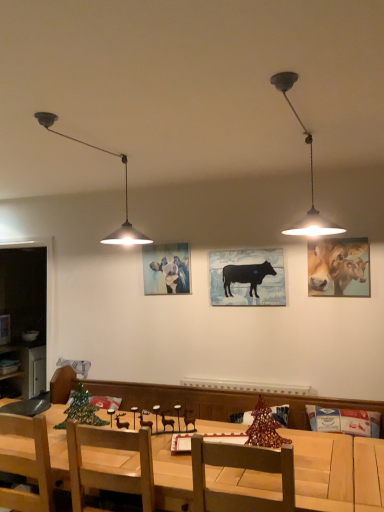
Where is `wooden table at center`? wooden table at center is located at coordinates (337, 471).

What are the coordinates of `golden glossy cattle at upper right, which is counted as the second cattle, starting from the back` in the screenshot? It's located at (335, 265).

Where is `metallic silver cabinet at left`? metallic silver cabinet at left is located at coordinates (32, 369).

Which point is more forward, (x=37, y=362) or (x=243, y=300)?

The point (x=243, y=300) is more forward.

Does metallic silver cabinet at left appear on the right side of black wooden cow at center?

No, metallic silver cabinet at left is not to the right of black wooden cow at center.

Is metallic silver cabinet at left bigger than black wooden cow at center?

Yes, metallic silver cabinet at left is bigger than black wooden cow at center.

Is golden glossy cattle at upper right, positioned as the first cattle in front-to-back order, positioned beyond the bounds of metallic pendant light at upper right, the second lamp positioned from the left?

Absolutely, golden glossy cattle at upper right, positioned as the first cattle in front-to-back order, is external to metallic pendant light at upper right, the second lamp positioned from the left.

Which is nearer, (334, 293) or (278, 84)?

Point (334, 293) is farther from the camera than point (278, 84).

Can you confirm if golden glossy cattle at upper right, the first cattle in the right-to-left sequence, is wider than metallic pendant light at upper right, the first lamp when ordered from right to left?

No.

Is golden glossy cattle at upper right, marked as the 2th cattle in a left-to-right arrangement, beside metallic pendant light at upper right, the second lamp positioned from the left?

golden glossy cattle at upper right, marked as the 2th cattle in a left-to-right arrangement, and metallic pendant light at upper right, the second lamp positioned from the left, are clearly separated.

In the scene shown: From a real-world perspective, relative to golden glossy cattle at upper right, marked as the 2th cattle in a left-to-right arrangement, is pastel blue painting of cattle at center, the 1th cattle from the back, vertically above or below?

Clearly, from a real-world perspective, pastel blue painting of cattle at center, the 1th cattle from the back, is above golden glossy cattle at upper right, marked as the 2th cattle in a left-to-right arrangement.

Considering the relative sizes of pastel blue painting of cattle at center, which is the 2th cattle from right to left, and golden glossy cattle at upper right, marked as the 2th cattle in a left-to-right arrangement, in the image provided, is pastel blue painting of cattle at center, which is the 2th cattle from right to left, wider than golden glossy cattle at upper right, marked as the 2th cattle in a left-to-right arrangement,?

Yes, pastel blue painting of cattle at center, which is the 2th cattle from right to left, is wider than golden glossy cattle at upper right, marked as the 2th cattle in a left-to-right arrangement.

Is pastel blue painting of cattle at center, the 1th cattle from the back, smaller than golden glossy cattle at upper right, positioned as the first cattle in front-to-back order?

Actually, pastel blue painting of cattle at center, the 1th cattle from the back, might be larger than golden glossy cattle at upper right, positioned as the first cattle in front-to-back order.

Which is less distant, (313,259) or (30,351)?

Positioned in front is point (313,259).

In the scene shown: From a real-world perspective, is golden glossy cattle at upper right, which is counted as the second cattle, starting from the back, physically located above or below metallic silver cabinet at left?

golden glossy cattle at upper right, which is counted as the second cattle, starting from the back, is situated higher than metallic silver cabinet at left in the real world.

Looking at this image, considering the relative sizes of golden glossy cattle at upper right, which is counted as the second cattle, starting from the back, and metallic silver cabinet at left in the image provided, is golden glossy cattle at upper right, which is counted as the second cattle, starting from the back, shorter than metallic silver cabinet at left?

Indeed, golden glossy cattle at upper right, which is counted as the second cattle, starting from the back, has a lesser height compared to metallic silver cabinet at left.

Who is smaller, golden glossy cattle at upper right, marked as the 2th cattle in a left-to-right arrangement, or metallic silver cabinet at left?

golden glossy cattle at upper right, marked as the 2th cattle in a left-to-right arrangement, is smaller.

Is metallic pendant light at left, marked as the 1th lamp in a left-to-right arrangement, placed right next to pastel blue painting of cattle at center, which ranks as the 1th cattle in left-to-right order?

No, metallic pendant light at left, marked as the 1th lamp in a left-to-right arrangement, is not next to pastel blue painting of cattle at center, which ranks as the 1th cattle in left-to-right order.

Which object is closer to the camera taking this photo, metallic pendant light at left, which ranks as the 2th lamp in right-to-left order, or pastel blue painting of cattle at center, the 1th cattle from the back?

Positioned in front is metallic pendant light at left, which ranks as the 2th lamp in right-to-left order.

Choose the correct answer: Is metallic pendant light at left, marked as the 1th lamp in a left-to-right arrangement, inside pastel blue painting of cattle at center, which ranks as the 1th cattle in left-to-right order, or outside it?

metallic pendant light at left, marked as the 1th lamp in a left-to-right arrangement, is spatially situated outside pastel blue painting of cattle at center, which ranks as the 1th cattle in left-to-right order.

Considering the sizes of objects metallic pendant light at left, marked as the 1th lamp in a left-to-right arrangement, and pastel blue painting of cattle at center, the 1th cattle from the back, in the image provided, who is smaller, metallic pendant light at left, marked as the 1th lamp in a left-to-right arrangement, or pastel blue painting of cattle at center, the 1th cattle from the back,?

pastel blue painting of cattle at center, the 1th cattle from the back.

Is the surface of golden glossy cattle at upper right, marked as the 2th cattle in a left-to-right arrangement, in direct contact with pastel blue painting of cattle at center, which ranks as the 1th cattle in left-to-right order?

No.

From a real-world perspective, is golden glossy cattle at upper right, positioned as the first cattle in front-to-back order, under pastel blue painting of cattle at center, the 1th cattle from the back?

Yes, from a real-world perspective, golden glossy cattle at upper right, positioned as the first cattle in front-to-back order, is beneath pastel blue painting of cattle at center, the 1th cattle from the back.

Looking at the image, does golden glossy cattle at upper right, which is counted as the second cattle, starting from the back, seem bigger or smaller compared to pastel blue painting of cattle at center, the 1th cattle from the back?

In the image, golden glossy cattle at upper right, which is counted as the second cattle, starting from the back, appears to be smaller than pastel blue painting of cattle at center, the 1th cattle from the back.

Locate an element on the screen. The height and width of the screenshot is (512, 384). picture frame below the golden glossy cattle at upper right, positioned as the first cattle in front-to-back order (from the image's perspective) is located at coordinates click(247, 277).

Is golden glossy cattle at upper right, which is counted as the second cattle, starting from the back, not within black wooden cow at center?

Yes, golden glossy cattle at upper right, which is counted as the second cattle, starting from the back, is located beyond the bounds of black wooden cow at center.

Which is in front, golden glossy cattle at upper right, marked as the 2th cattle in a left-to-right arrangement, or black wooden cow at center?

golden glossy cattle at upper right, marked as the 2th cattle in a left-to-right arrangement, is in front.

Is golden glossy cattle at upper right, the first cattle in the right-to-left sequence, positioned with its back to black wooden cow at center?

That's not correct — golden glossy cattle at upper right, the first cattle in the right-to-left sequence, is not looking away from black wooden cow at center.

At what (x,y) coordinates should I click in order to perform the action: click on cabinetry below the black wooden cow at center (from a real-world perspective). Please return your answer as a coordinate pair (x, y). Image resolution: width=384 pixels, height=512 pixels. Looking at the image, I should click on (x=32, y=369).

The height and width of the screenshot is (512, 384). What are the coordinates of `the 1st cattle below when counting from the metallic pendant light at upper right, the second lamp positioned from the left (from the image's perspective)` in the screenshot? It's located at (335, 265).

From the image, which object appears to be nearer to metallic silver cabinet at left, black wooden cow at center or wooden chair at center?

Among the two, black wooden cow at center is located nearer to metallic silver cabinet at left.

Considering their positions, is metallic pendant light at upper right, the first lamp when ordered from right to left, positioned further to wooden chair at center than metallic pendant light at left, marked as the 1th lamp in a left-to-right arrangement?

metallic pendant light at upper right, the first lamp when ordered from right to left, lies further to wooden chair at center than the other object.

Looking at the image, which one is located closer to wooden table at center, golden glossy cattle at upper right, marked as the 2th cattle in a left-to-right arrangement, or metallic pendant light at upper right, the first lamp when ordered from right to left?

The object closer to wooden table at center is golden glossy cattle at upper right, marked as the 2th cattle in a left-to-right arrangement.

Looking at the image, which one is located further to pastel blue painting of cattle at center, which is the 2th cattle from right to left, wooden chair at center or metallic silver cabinet at left?

wooden chair at center.

Based on their spatial positions, is metallic silver cabinet at left or golden glossy cattle at upper right, the first cattle in the right-to-left sequence, further from pastel blue painting of cattle at center, which ranks as the 1th cattle in left-to-right order?

metallic silver cabinet at left.

Looking at this image, considering their positions, is black wooden cow at center positioned further to golden glossy cattle at upper right, the first cattle in the right-to-left sequence, than metallic pendant light at upper right, the first lamp when ordered from right to left?

black wooden cow at center.

When comparing their distances from metallic pendant light at left, marked as the 1th lamp in a left-to-right arrangement, does pastel blue painting of cattle at center, arranged as the 2th cattle when viewed from the front, or black wooden cow at center seem further?

Based on the image, black wooden cow at center appears to be further to metallic pendant light at left, marked as the 1th lamp in a left-to-right arrangement.

Based on their spatial positions, is golden glossy cattle at upper right, which is counted as the second cattle, starting from the back, or metallic pendant light at upper right, the second lamp positioned from the left, further from metallic pendant light at left, which ranks as the 2th lamp in right-to-left order?

Based on the image, golden glossy cattle at upper right, which is counted as the second cattle, starting from the back, appears to be further to metallic pendant light at left, which ranks as the 2th lamp in right-to-left order.

The height and width of the screenshot is (512, 384). I want to click on cattle between metallic pendant light at upper right, the second lamp positioned from the left, and black wooden cow at center, along the z-axis, so click(335, 265).

Find the location of `picture frame between metallic silver cabinet at left and golden glossy cattle at upper right, marked as the 2th cattle in a left-to-right arrangement, in the horizontal direction`. picture frame between metallic silver cabinet at left and golden glossy cattle at upper right, marked as the 2th cattle in a left-to-right arrangement, in the horizontal direction is located at coordinates (247, 277).

The height and width of the screenshot is (512, 384). I want to click on cabinetry located between metallic pendant light at left, marked as the 1th lamp in a left-to-right arrangement, and pastel blue painting of cattle at center, the 1th cattle from the back, in the depth direction, so click(32, 369).

Locate an element on the screen. The image size is (384, 512). cabinetry that lies between metallic pendant light at left, which ranks as the 2th lamp in right-to-left order, and wooden table at center from top to bottom is located at coordinates (32, 369).